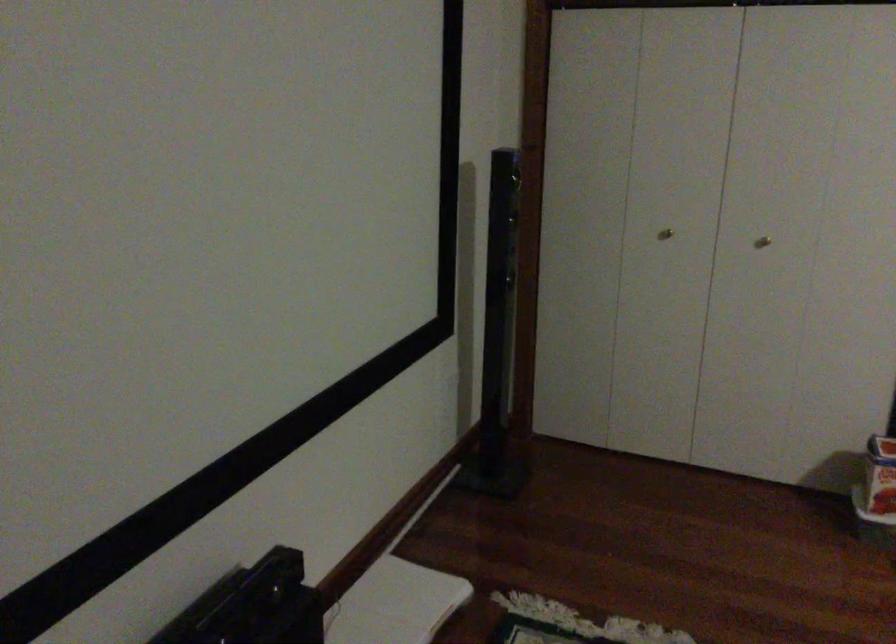
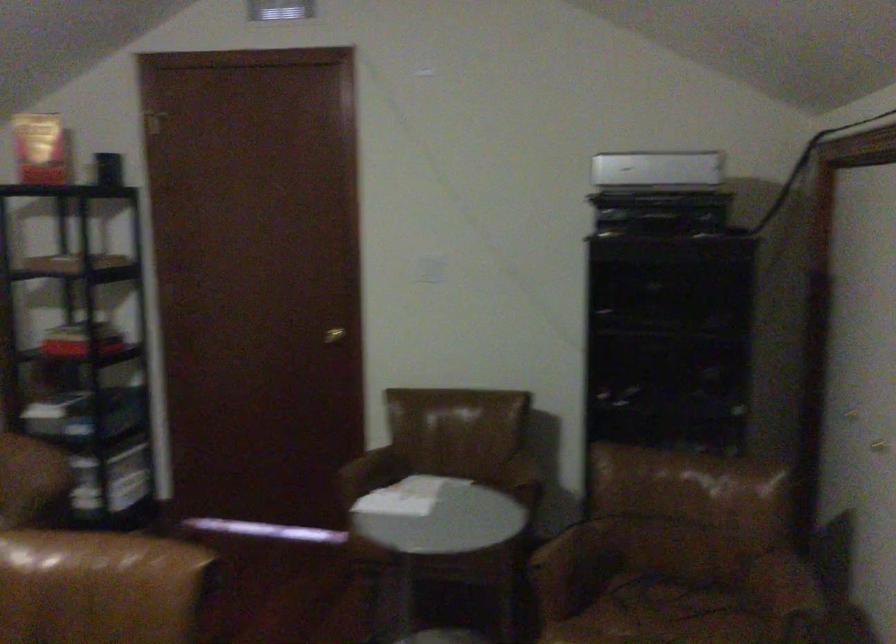
Question: The camera is either moving clockwise (left) or counter-clockwise (right) around the object. The first image is from the beginning of the video and the second image is from the end. Is the camera moving left or right when shooting the video?

Choices:
 (A) Left
 (B) Right

Answer: (A)